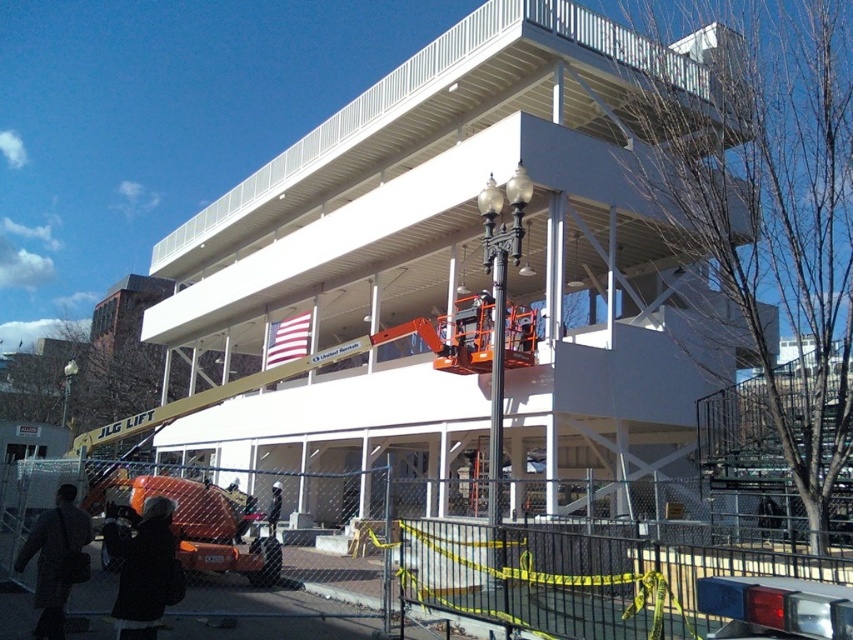
You are a construction worker who just arrived at the site and need to retrieve your dark gray coat at lower left. Where should you look for it?

The dark gray coat at lower left is located at point [56,560], so you should look there.

You are a construction worker who just arrived at the site. You see the dark gray coat at lower left and the black fabric jacket at center. Which one is taller?

The dark gray coat at lower left is taller than the black fabric jacket at center.

You are standing at the construction site and want to reach a specific point for inspection. The point is located at coordinates point (152,525). Given that the JLG Lift crane can safely operate within a 10 meter radius, can the crane safely reach this point?

The distance of point (152,525) from viewer is 8.88 meters, so yes, the JLG Lift crane can safely reach this point since it is within the 10 meter radius.